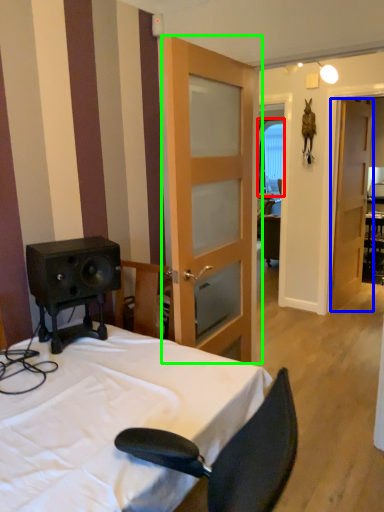
Question: Based on their relative distances, which object is nearer to window (highlighted by a red box)? Choose from door (highlighted by a blue box) and door (highlighted by a green box).

Choices:
 (A) door
 (B) door

Answer: (A)